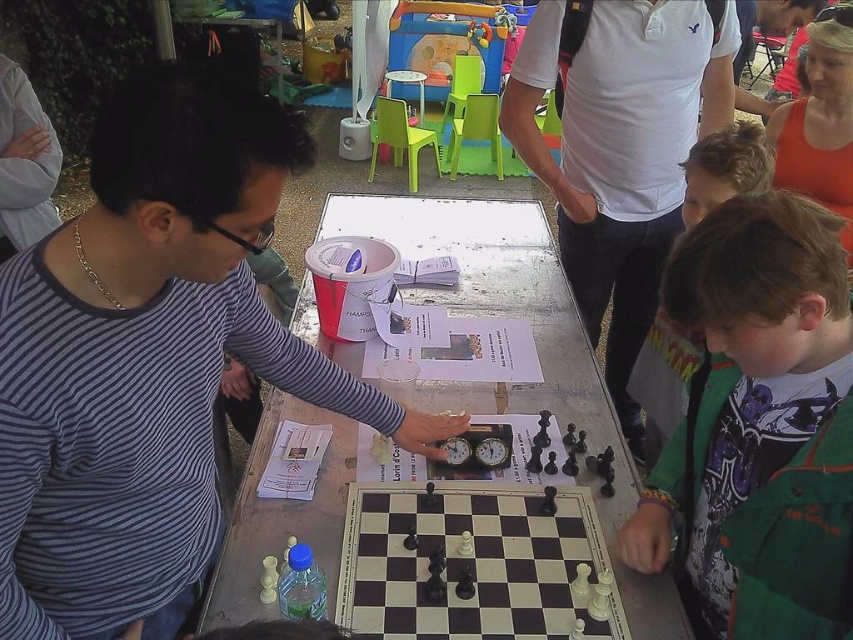
You are standing at the center of the table where the chessboard is placed. You want to place a small chess piece into the red bucket. Which direction should you move to reach the green textured jacket at lower right?

The green textured jacket at lower right is located at point [759,424], so you should move towards the lower right direction to reach it.

You are a photographer standing at the edge of the chess tournament area. You want to take a photo that includes both the striped cotton shirt at left and the wooden chessboard at center. Given that your camera has a maximum focus range of 12 inches, will you be able to capture both objects in focus without moving closer?

The striped cotton shirt at left and wooden chessboard at center are 13.12 inches apart. Since the distance between them exceeds the camera focus range of 12 inches, you won not be able to capture both in focus without moving closer.

You are a participant in the chess tournament and need to retrieve your jacket. You see the green textured jacket at lower right and the green fleece jacket at right. Which jacket is positioned lower on the table?

The green textured jacket at lower right is positioned lower than the green fleece jacket at right.